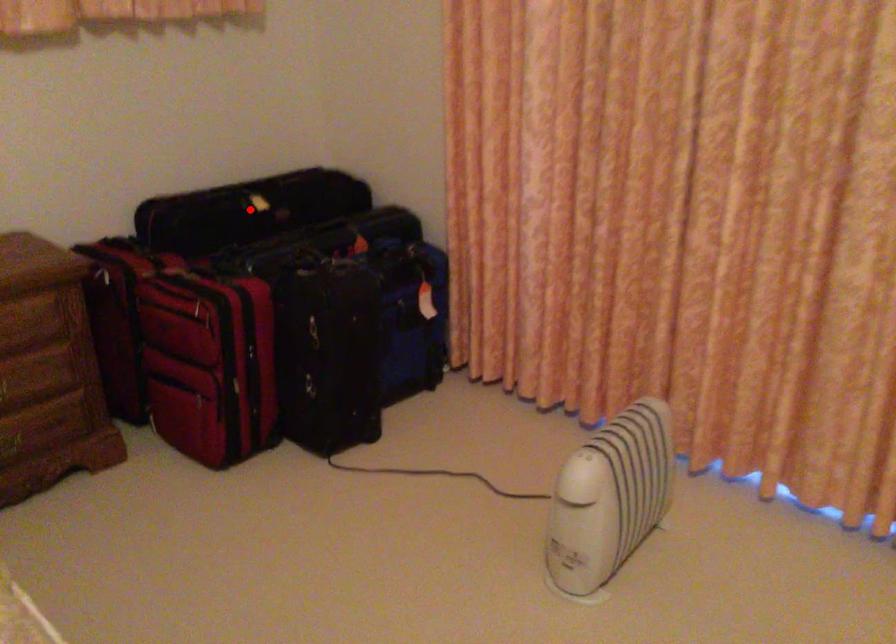
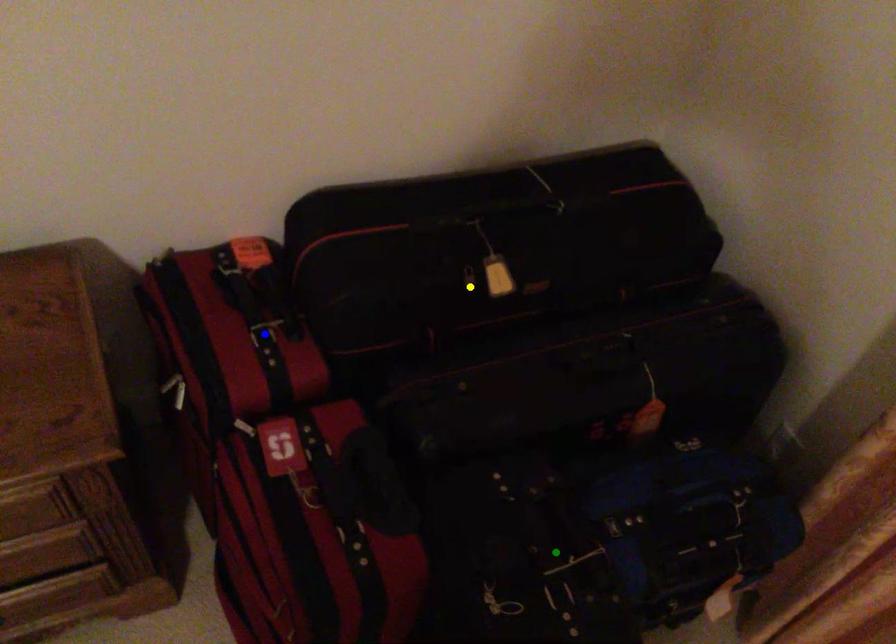
Question: I am providing you with two images of the same scene from different viewpoints. A red point is marked on the first image. You are given multiple points on the second image. Which spot in image 2 lines up with the point in image 1?

Choices:
 (A) green point
 (B) yellow point
 (C) blue point

Answer: (B)